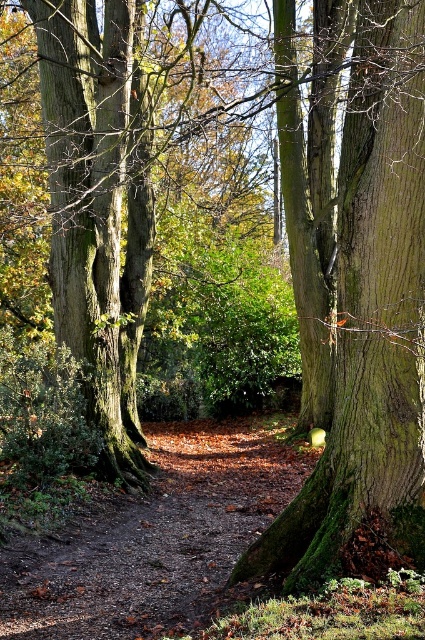
Question: Does green mossy tree trunk at right have a greater width compared to green mossy tree at left?

Choices:
 (A) yes
 (B) no

Answer: (B)

Question: Considering the relative positions of green mossy tree trunk at right and green mossy tree at left in the image provided, where is green mossy tree trunk at right located with respect to green mossy tree at left?

Choices:
 (A) right
 (B) left

Answer: (A)

Question: Does green mossy tree trunk at right have a lesser width compared to green mossy tree at left?

Choices:
 (A) yes
 (B) no

Answer: (A)

Question: Which point is closer to the camera?

Choices:
 (A) green mossy tree at left
 (B) green mossy tree trunk at right

Answer: (B)

Question: Which point is farther to the camera?

Choices:
 (A) (345, 451)
 (B) (107, 196)

Answer: (B)

Question: Which of the following is the farthest from the observer?

Choices:
 (A) green mossy tree trunk at right
 (B) green mossy tree at left

Answer: (B)